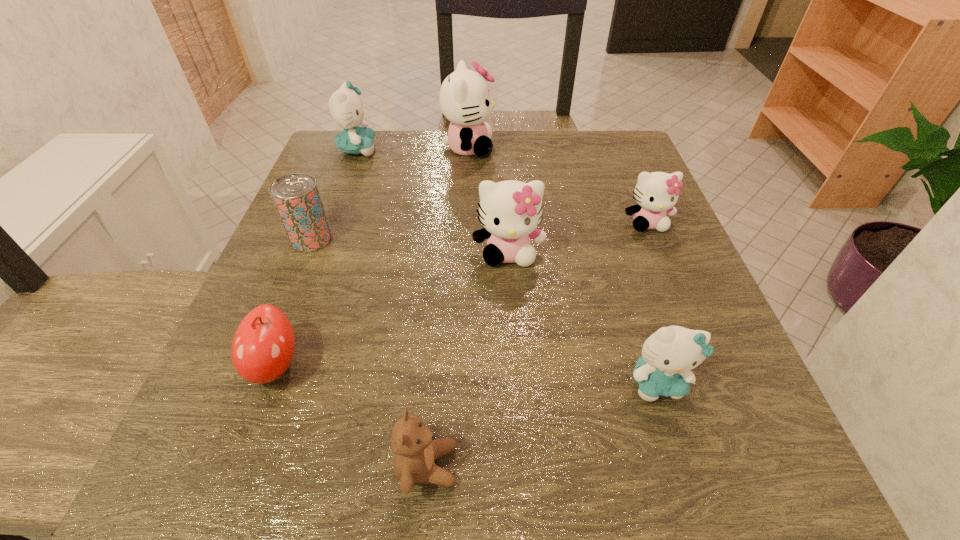
This screenshot has width=960, height=540. Find the location of `free location at the far right corner`. free location at the far right corner is located at coordinates (618, 153).

Image resolution: width=960 pixels, height=540 pixels. In order to click on vacant space at the near right corner of the desktop in this screenshot , I will do `click(740, 481)`.

Image resolution: width=960 pixels, height=540 pixels. What are the coordinates of `vacant area that lies between the second smallest white kitten and the teddy bear` in the screenshot? It's located at (468, 359).

Locate an element on the screen. blank region between the beer can and the second smallest white kitten is located at coordinates (410, 246).

This screenshot has height=540, width=960. I want to click on unoccupied position between the tallest kitten and the beer can, so click(390, 193).

Image resolution: width=960 pixels, height=540 pixels. Identify the location of vacant area between the second biggest white kitten and the right blue kitten. (583, 318).

Identify the location of free space between the nearest kitten and the nearest object. (542, 424).

Identify the location of vacant space in between the apple and the beer can. The width and height of the screenshot is (960, 540). (294, 302).

Locate an element on the screen. The width and height of the screenshot is (960, 540). vacant point located between the apple and the right blue kitten is located at coordinates (467, 374).

Locate an element on the screen. This screenshot has width=960, height=540. free spot between the beer can and the second biggest white kitten is located at coordinates (410, 246).